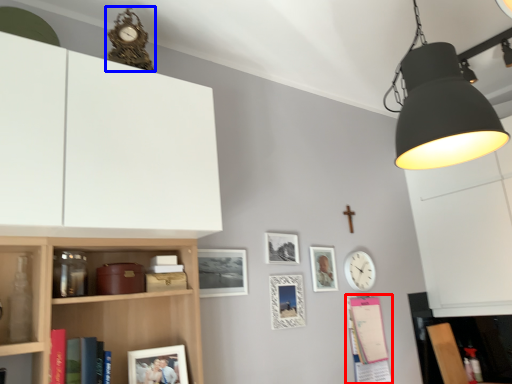
Question: Which point is closer to the camera, book (highlighted by a red box) or clock (highlighted by a blue box)?

Choices:
 (A) book
 (B) clock

Answer: (B)